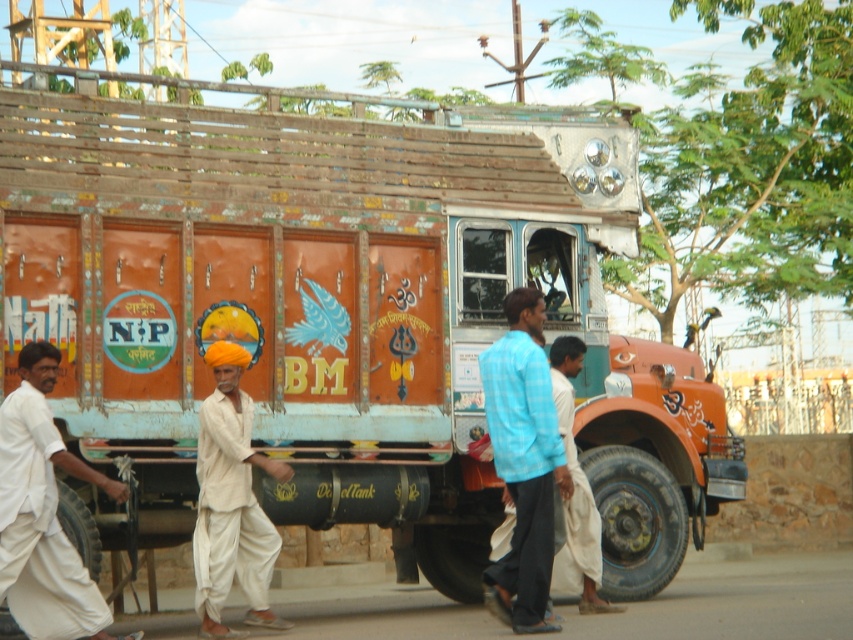
Between white cotton turban at left and blue plaid shirt at lower center, which one appears on the left side from the viewer's perspective?

white cotton turban at left is more to the left.

Measure the distance between point (32, 552) and camera.

Answer: They are 11.05 meters apart.

I want to click on white cotton turban at left, so click(x=44, y=513).

Can you confirm if white cotton turban at left is taller than white cotton turban at center?

No, white cotton turban at left is not taller than white cotton turban at center.

Which is in front, point (70, 548) or point (213, 637)?

Point (70, 548) is more forward.

Between point (15, 614) and point (242, 470), which one is positioned in front?

Point (15, 614) is more forward.

I want to click on white cotton turban at left, so click(x=44, y=513).

In the scene shown: Does blue plaid shirt at lower center have a smaller size compared to white cotton turban at center?

Actually, blue plaid shirt at lower center might be larger than white cotton turban at center.

Which is below, blue plaid shirt at lower center or white cotton turban at center?

white cotton turban at center is lower down.

Between point (515, 337) and point (213, 545), which one is positioned behind?

Positioned behind is point (515, 337).

Locate an element on the screen. The width and height of the screenshot is (853, 640). blue plaid shirt at lower center is located at coordinates (523, 461).